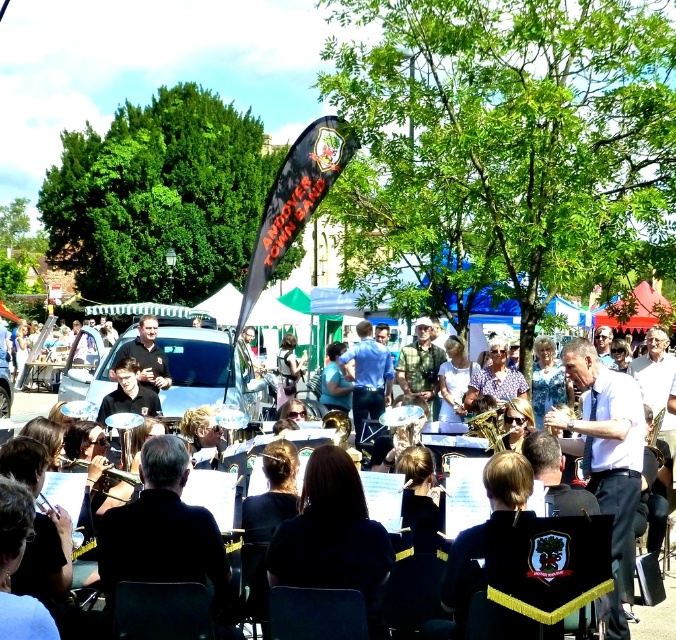
Between point (573, 349) and point (145, 323), which one is positioned in front?

Point (573, 349) is more forward.

Which is in front, point (602, 504) or point (91, 470)?

Positioned in front is point (91, 470).

Where is `white shirt at center`? white shirt at center is located at coordinates (604, 451).

Is blue shirt at center thinner than black uniform at center?

Correct, blue shirt at center's width is less than black uniform at center's.

Is blue shirt at center closer to the viewer compared to black uniform at center?

No, it is not.

This screenshot has width=676, height=640. What do you see at coordinates (366, 376) in the screenshot?
I see `blue shirt at center` at bounding box center [366, 376].

You are a GUI agent. You are given a task and a screenshot of the screen. Output one action in this format:
    pyautogui.click(x=<x>, y=<y>)
    Task: Click on the blue shirt at center
    The image size is (676, 640).
    Given the screenshot: What is the action you would take?
    pyautogui.click(x=366, y=376)

From the picture: Can you confirm if white shirt at center is bigger than blue shirt at center?

Yes, white shirt at center is bigger than blue shirt at center.

Is point (573, 355) closer to viewer compared to point (366, 378)?

Yes.

This screenshot has width=676, height=640. I want to click on white shirt at center, so click(x=604, y=451).